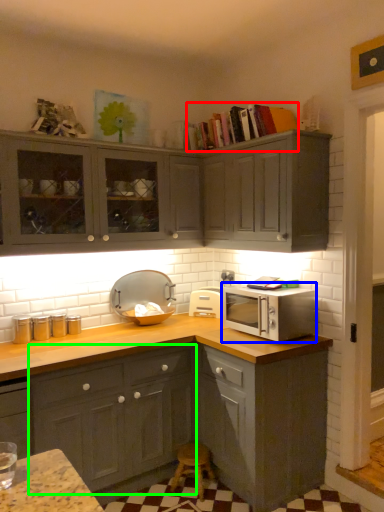
Question: Considering the real-world distances, which object is closest to book (highlighted by a red box)? microwave oven (highlighted by a blue box) or cabinetry (highlighted by a green box).

Choices:
 (A) microwave oven
 (B) cabinetry

Answer: (A)